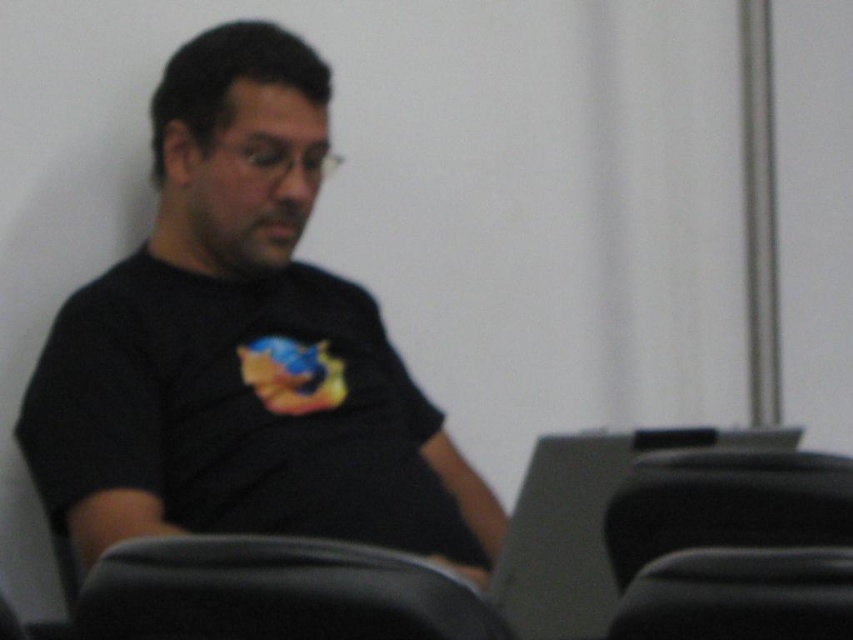
Is black matte t-shirt at center thinner than black leather chair at lower right?

No.

Identify the location of black matte t-shirt at center. (242, 348).

Is point (412, 620) farther from camera compared to point (648, 596)?

No, (412, 620) is closer to viewer.

Identify the location of black leather chair at lower center. (274, 593).

This screenshot has width=853, height=640. What are the coordinates of `black leather chair at lower center` in the screenshot? It's located at (274, 593).

Locate an element on the screen. The width and height of the screenshot is (853, 640). black leather chair at lower center is located at coordinates [274, 593].

Is black leather chair at lower center smaller than black plastic swivel chair at lower right?

Yes.

Which of these two, black leather chair at lower center or black plastic swivel chair at lower right, stands taller?

black plastic swivel chair at lower right is taller.

Is point (149, 605) positioned in front of point (704, 506)?

Yes, point (149, 605) is closer to viewer.

This screenshot has width=853, height=640. Identify the location of black leather chair at lower center. (274, 593).